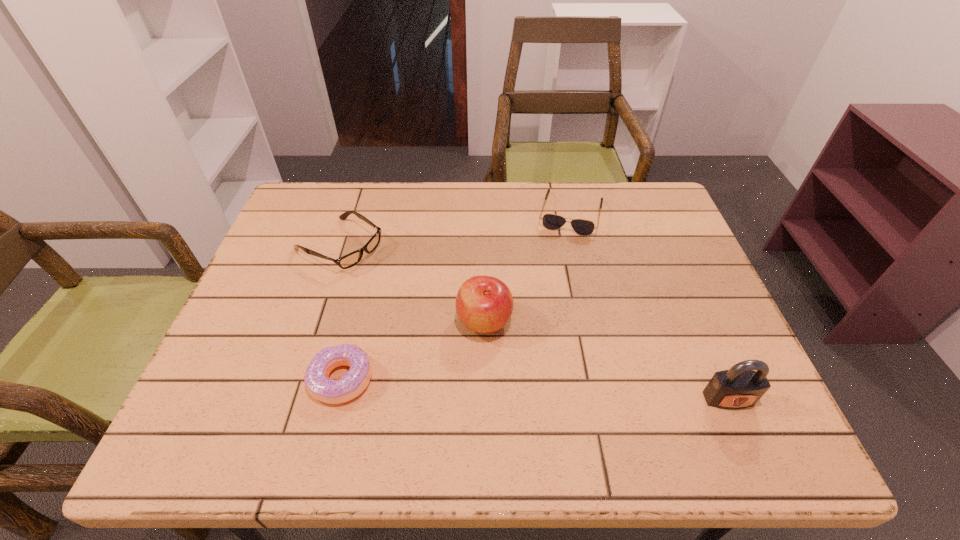
Find the location of a particular element. doughnut is located at coordinates (354, 382).

Find the location of a particular element. The height and width of the screenshot is (540, 960). padlock is located at coordinates (740, 387).

Locate an element on the screen. The width and height of the screenshot is (960, 540). the third object from right to left is located at coordinates (484, 304).

The height and width of the screenshot is (540, 960). What are the coordinates of `the third nearest object` in the screenshot? It's located at (484, 304).

At what (x,y) coordinates should I click in order to perform the action: click on the second object from right to left. Please return your answer as a coordinate pair (x, y). Looking at the image, I should click on (582, 227).

Locate an element on the screen. This screenshot has height=540, width=960. spectacles is located at coordinates (351, 259).

Locate an element on the screen. Image resolution: width=960 pixels, height=540 pixels. free region located 0.170m on the back of the doughnut is located at coordinates (362, 296).

The height and width of the screenshot is (540, 960). Find the location of `free space located 0.110m on the stem of the third farthest object`. free space located 0.110m on the stem of the third farthest object is located at coordinates (531, 376).

You are a GUI agent. You are given a task and a screenshot of the screen. Output one action in this format:
    pyautogui.click(x=<x>, y=<y>)
    Task: Click on the free spot located on the stem of the third farthest object
    The image size is (960, 540).
    Given the screenshot: What is the action you would take?
    coord(519,363)

The image size is (960, 540). I want to click on vacant space located 0.080m on the stem of the third farthest object, so click(522, 366).